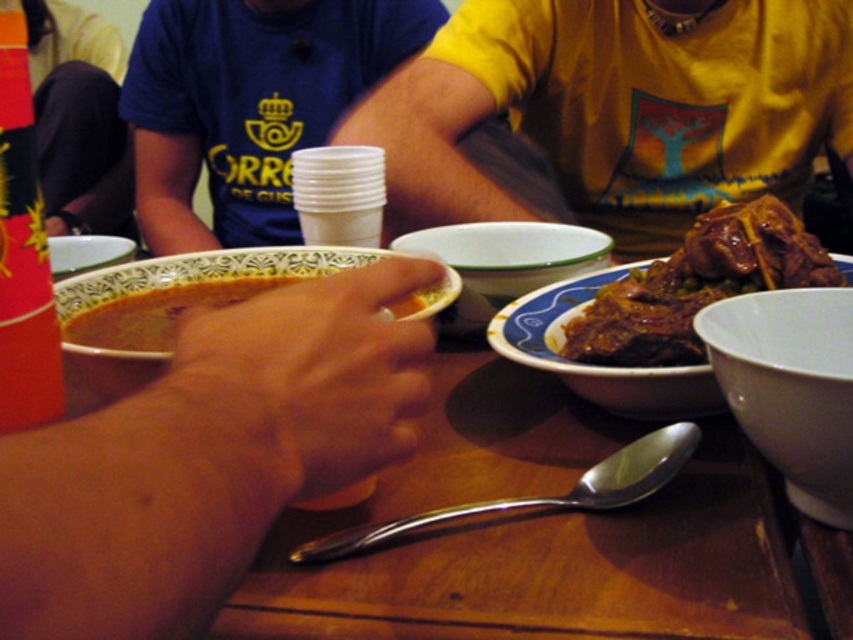
You are a chef arranging dishes on a table. You have a white ceramic bowl at center and a brown glossy meat at right. The distance between them is crucial for presentation. Can you place a 10 cm decorative plate between them without overlapping?

The white ceramic bowl at center is 9.85 centimeters from the brown glossy meat at right. Since the decorative plate is 10 cm wide, placing it between them would cause overlapping as the space is slightly less than the plate size.